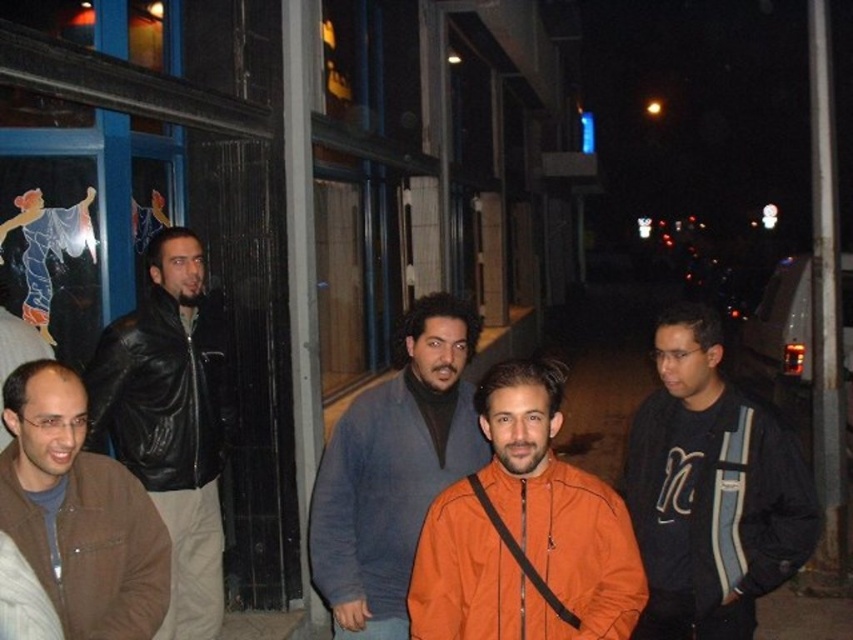
Does black matte jacket at right have a lesser width compared to gray sweater at center?

No, black matte jacket at right is not thinner than gray sweater at center.

Identify the location of black matte jacket at right. Image resolution: width=853 pixels, height=640 pixels. (711, 490).

This screenshot has width=853, height=640. Find the location of `black matte jacket at right`. black matte jacket at right is located at coordinates (711, 490).

Is black matte jacket at right smaller than orange matte jacket at center?

Incorrect, black matte jacket at right is not smaller in size than orange matte jacket at center.

Identify the location of black matte jacket at right. (711, 490).

Locate an element on the screen. black matte jacket at right is located at coordinates (711, 490).

Which of these two, gray sweater at center or brown leather jacket at lower left, stands taller?

gray sweater at center

Does point (408, 552) lie behind point (65, 538)?

Yes.

I want to click on gray sweater at center, so click(x=393, y=470).

Locate an element on the screen. gray sweater at center is located at coordinates (393, 470).